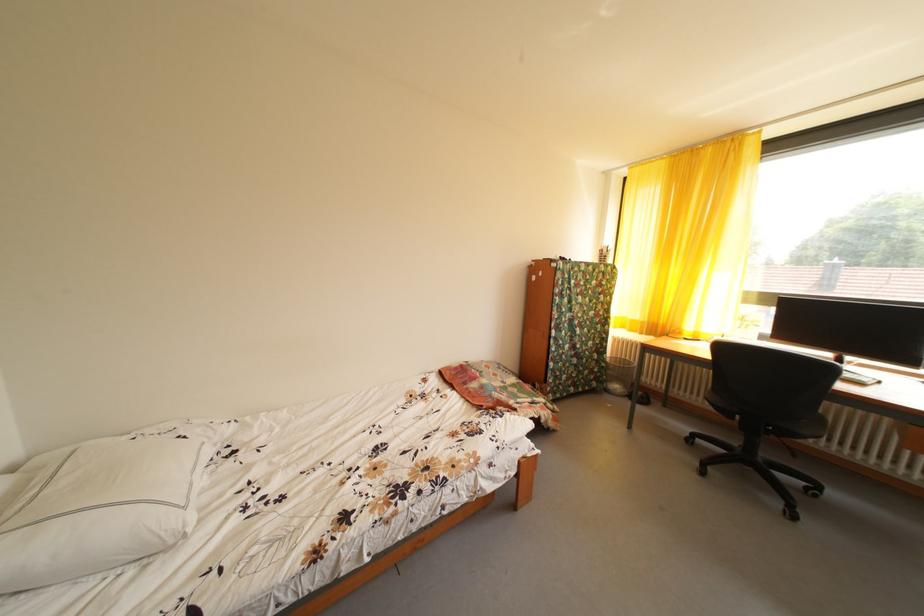
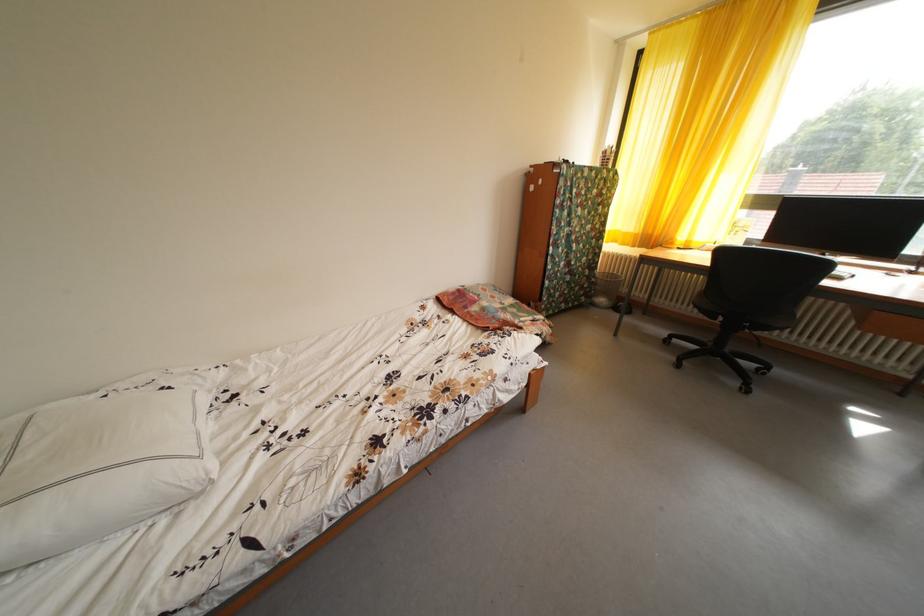
Locate, in the second image, the point that corresponds to (x=159, y=437) in the first image.

(131, 391)